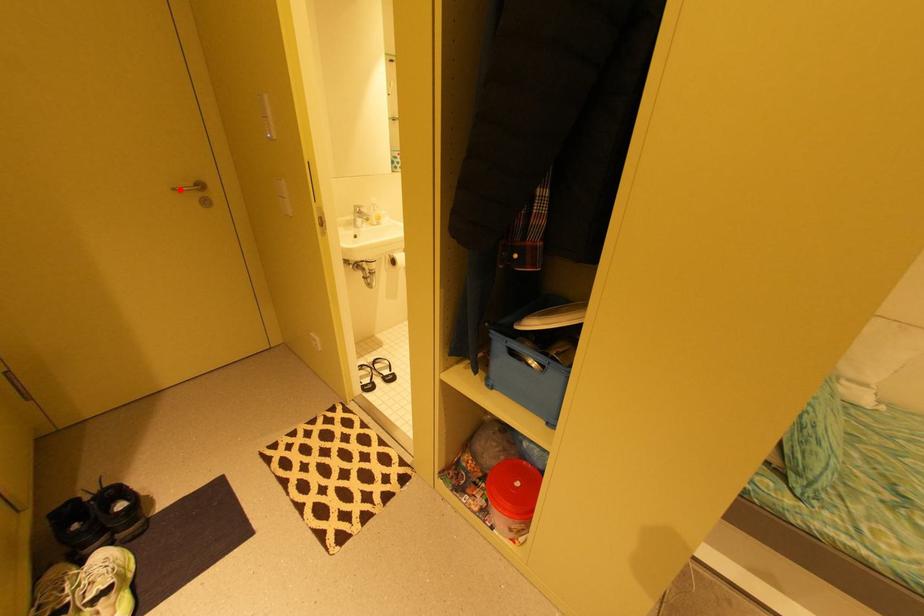
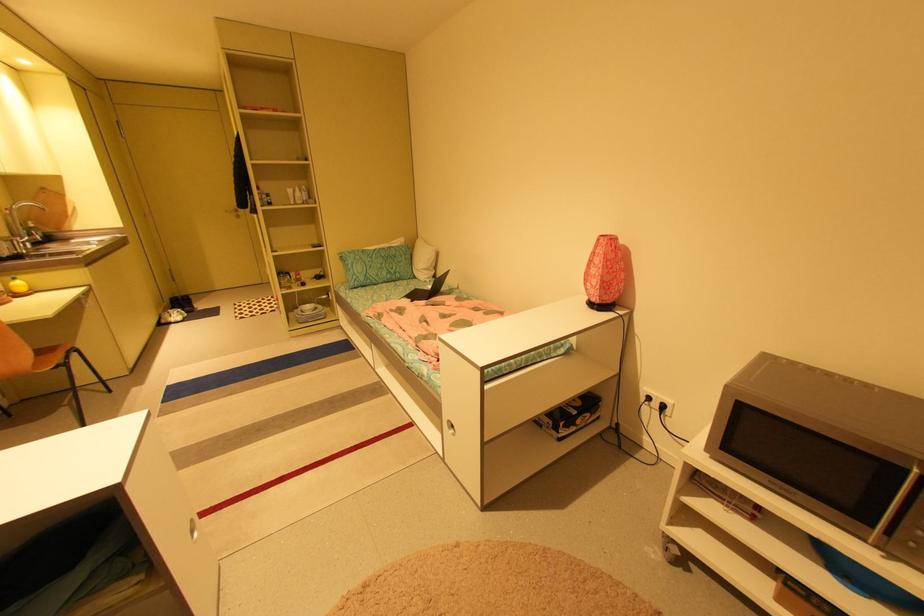
In the second image, find the point that corresponds to the highlighted location in the first image.

(232, 211)